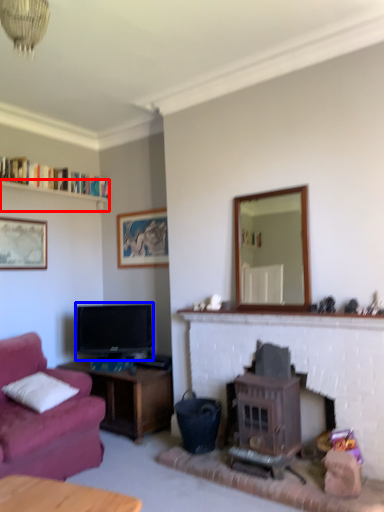
Question: Which point is closer to the camera, shelf (highlighted by a red box) or television (highlighted by a blue box)?

Choices:
 (A) shelf
 (B) television

Answer: (A)